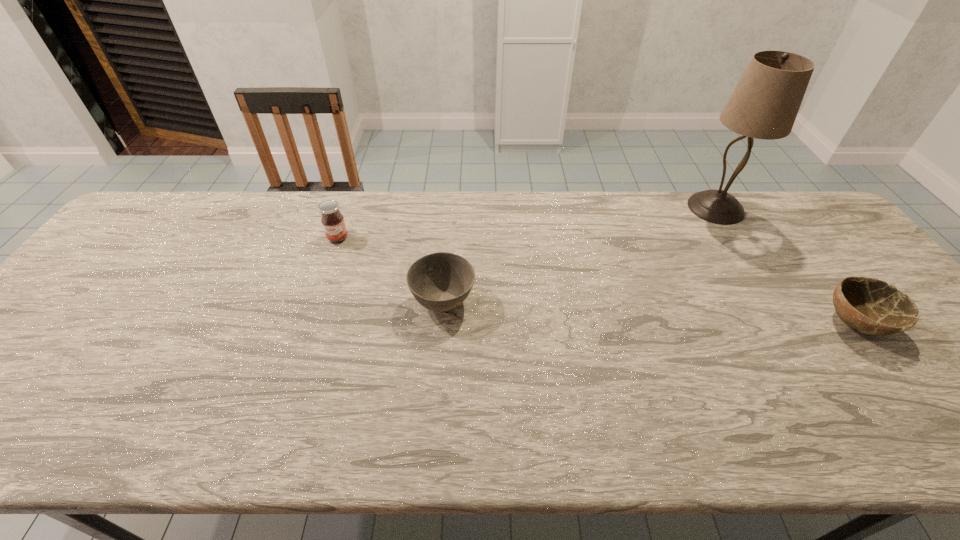
In order to click on the tallest object in this screenshot , I will do `click(764, 105)`.

This screenshot has height=540, width=960. What are the coordinates of `lampshade` in the screenshot? It's located at [x=764, y=105].

What are the coordinates of `the leftmost object` in the screenshot? It's located at (332, 220).

Identify the location of jam. (332, 220).

Identify the location of the left bowl. This screenshot has height=540, width=960. (441, 281).

Locate an element on the screen. the right bowl is located at coordinates (871, 306).

At what (x,y) coordinates should I click in order to perform the action: click on blank space located on the front-facing side of the lampshade. Please return your answer as a coordinate pair (x, y). This screenshot has height=540, width=960. Looking at the image, I should click on (594, 208).

What are the coordinates of `vacant space located 0.310m on the front-facing side of the lampshade` in the screenshot? It's located at (591, 208).

Where is `vacant space located on the front-facing side of the lampshade`? The width and height of the screenshot is (960, 540). vacant space located on the front-facing side of the lampshade is located at coordinates click(662, 208).

You are a GUI agent. You are given a task and a screenshot of the screen. Output one action in this format:
    pyautogui.click(x=<x>, y=<y>)
    Task: Click on the blank space located on the label side of the jam
    Image resolution: width=960 pixels, height=540 pixels.
    Given the screenshot: What is the action you would take?
    pyautogui.click(x=325, y=274)